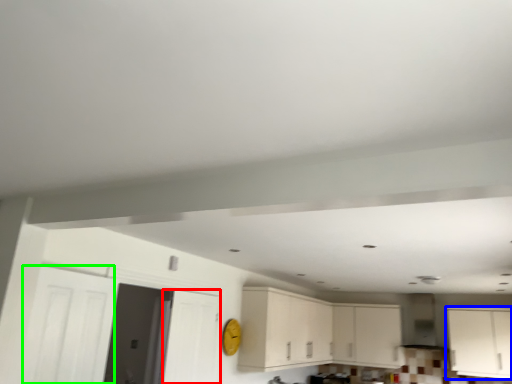
Question: Which is farther away from door (highlighted by a red box)? cabinetry (highlighted by a blue box) or door (highlighted by a green box)?

Choices:
 (A) cabinetry
 (B) door

Answer: (A)